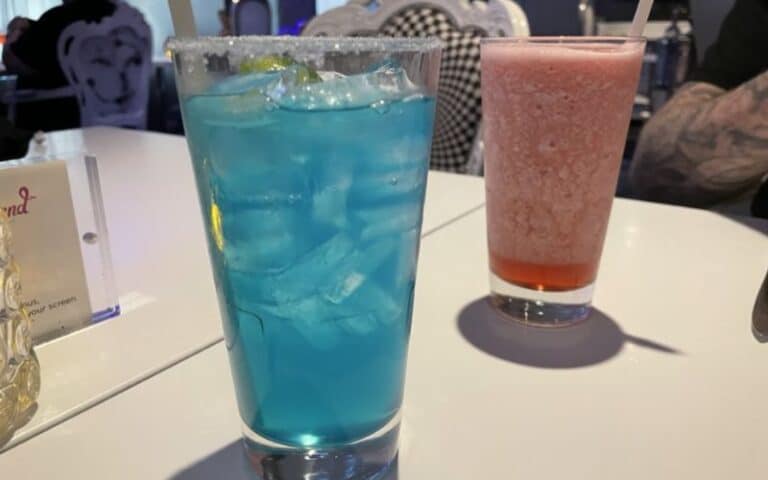
Where is `table seam`? The height and width of the screenshot is (480, 768). table seam is located at coordinates (147, 373), (458, 217).